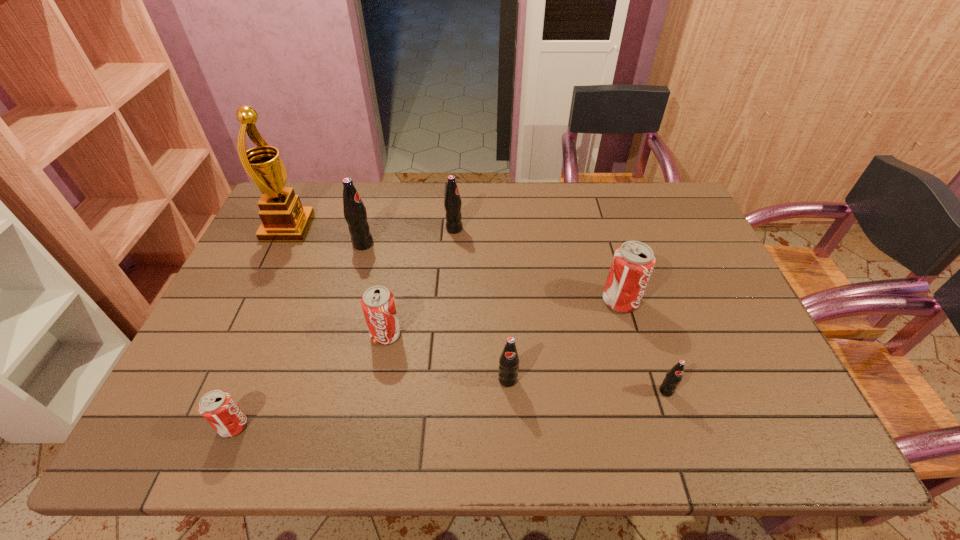
This screenshot has height=540, width=960. I want to click on the third soda can from right to left, so click(x=509, y=360).

I want to click on the second black pop from right to left, so click(x=509, y=360).

Where is `the rightmost black pop`? the rightmost black pop is located at coordinates (674, 376).

The height and width of the screenshot is (540, 960). In order to click on the nearest soda can in this screenshot , I will do `click(219, 409)`.

Locate an element on the screen. the nearest object is located at coordinates (219, 409).

Identify the location of vacant space located 0.360m on the front-facing side of the award. (421, 227).

You are a GUI agent. You are given a task and a screenshot of the screen. Output one action in this format:
    pyautogui.click(x=<x>, y=<y>)
    Task: Click on the free point located 0.140m on the front label of the leftmost black pop
    Image resolution: width=960 pixels, height=540 pixels.
    Given the screenshot: What is the action you would take?
    pyautogui.click(x=419, y=244)

The image size is (960, 540). I want to click on free space located 0.240m on the front label of the third smallest black pop, so click(x=538, y=229).

You are a GUI agent. You are given a task and a screenshot of the screen. Output one action in this format:
    pyautogui.click(x=<x>, y=<y>)
    Task: Click on the vacant space located 0.080m on the right of the farthest pink soda can
    The image size is (960, 540).
    Given the screenshot: What is the action you would take?
    pyautogui.click(x=667, y=301)

The image size is (960, 540). Find the location of `vacant area located 0.210m on the front of the fourth nearest soda can`. vacant area located 0.210m on the front of the fourth nearest soda can is located at coordinates (369, 428).